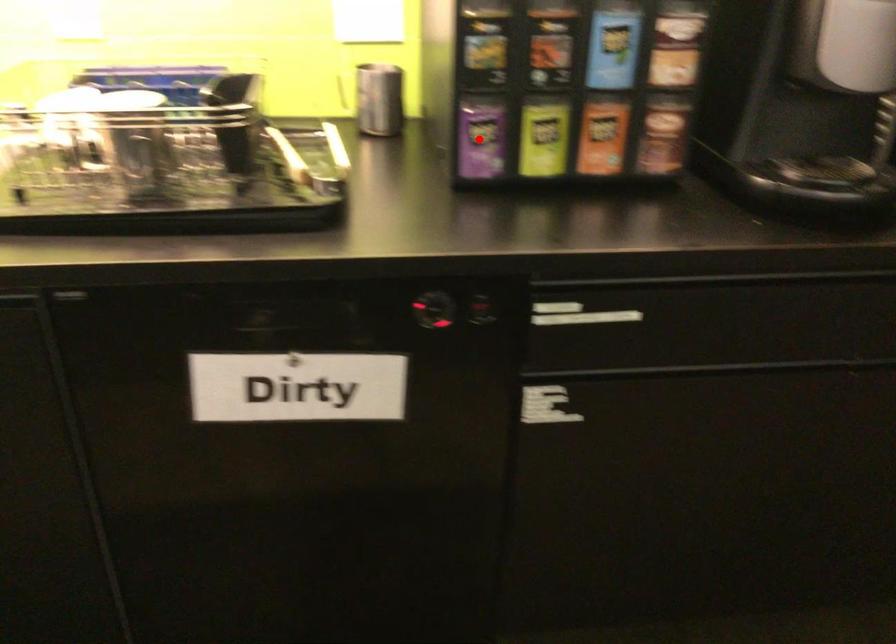
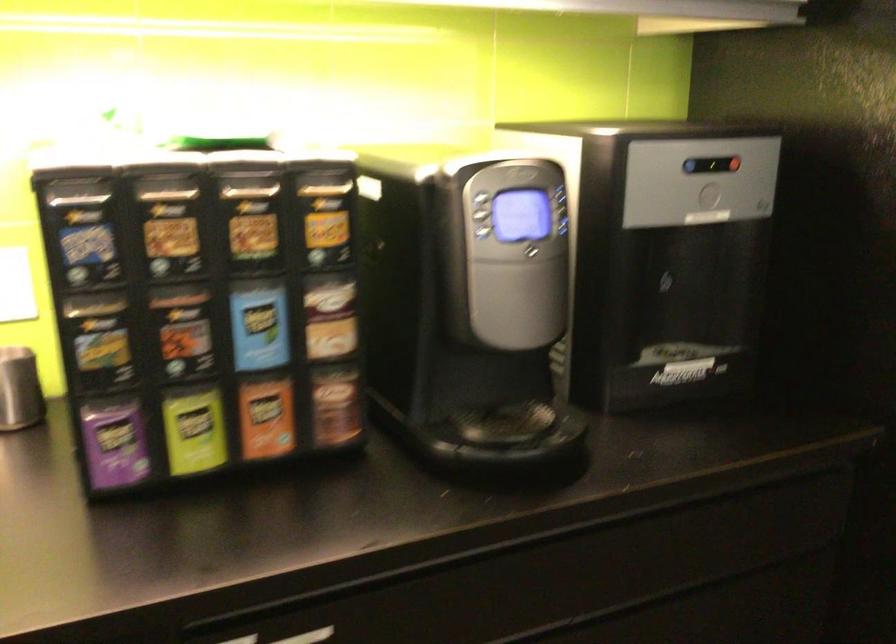
The point at the highlighted location is marked in the first image. Where is the corresponding point in the second image?

(114, 442)